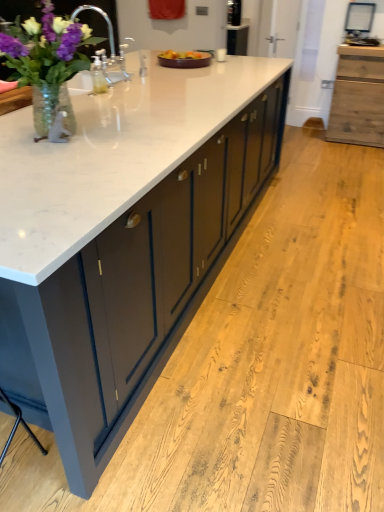
Question: Is point (345, 111) positioned closer to the camera than point (142, 257)?

Choices:
 (A) closer
 (B) farther

Answer: (B)

Question: Is wooden cabinet at right to the left or to the right of white marble countertop at center in the image?

Choices:
 (A) right
 (B) left

Answer: (A)

Question: Which of these objects is positioned farthest from the white glossy sink at upper left?

Choices:
 (A) brown ceramic tray at center
 (B) white marble countertop at center
 (C) wooden cabinet at right
 (D) clear glass vase at left

Answer: (C)

Question: Estimate the real-world distances between objects in this image. Which object is farther from the white glossy sink at upper left?

Choices:
 (A) clear glass vase at left
 (B) wooden cabinet at right
 (C) brown ceramic tray at center
 (D) white marble countertop at center

Answer: (B)